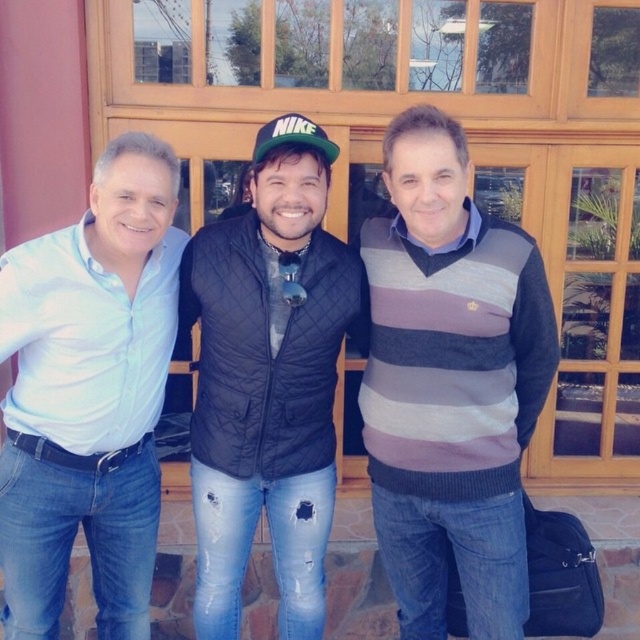
Looking at this image, does striped sweater at center have a smaller size compared to green matte baseball cap at center?

No, striped sweater at center is not smaller than green matte baseball cap at center.

Is striped sweater at center above green matte baseball cap at center?

No.

The width and height of the screenshot is (640, 640). Find the location of `striped sweater at center`. striped sweater at center is located at coordinates (451, 385).

Is the position of light blue cotton shirt at left less distant than that of green matte baseball cap at center?

Yes, it is in front of green matte baseball cap at center.

Does light blue cotton shirt at left have a greater height compared to green matte baseball cap at center?

Indeed, light blue cotton shirt at left has a greater height compared to green matte baseball cap at center.

Which is behind, point (17, 282) or point (266, 134)?

Positioned behind is point (266, 134).

Identify the location of light blue cotton shirt at left. (90, 394).

Can you confirm if light blue cotton shirt at left is bigger than black quilted vest at center?

Yes, light blue cotton shirt at left is bigger than black quilted vest at center.

Is light blue cotton shirt at left taller than black quilted vest at center?

Indeed, light blue cotton shirt at left has a greater height compared to black quilted vest at center.

Between point (129, 337) and point (323, 337), which one is positioned in front?

Point (129, 337) is more forward.

This screenshot has width=640, height=640. What are the coordinates of `light blue cotton shirt at left` in the screenshot? It's located at (90, 394).